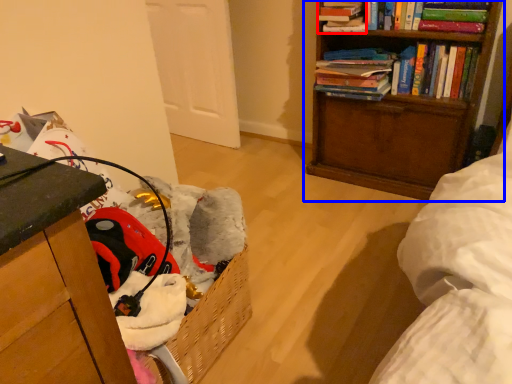
Question: Which point is closer to the camera, book (highlighted by a red box) or bookcase (highlighted by a blue box)?

Choices:
 (A) book
 (B) bookcase

Answer: (B)